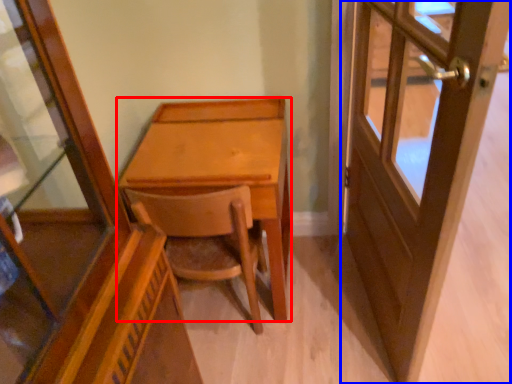
Question: Which point is further to the camera, desk (highlighted by a red box) or door (highlighted by a blue box)?

Choices:
 (A) desk
 (B) door

Answer: (A)